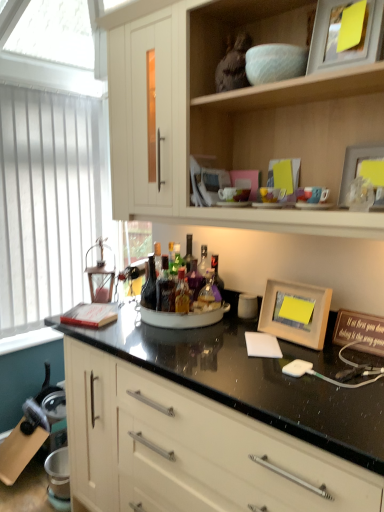
Question: Is white vertical blinds at left in front of light wood cabinet at upper center, the 1th cabinetry from the top?

Choices:
 (A) yes
 (B) no

Answer: (B)

Question: Can you confirm if white vertical blinds at left is taller than light wood cabinet at upper center, the 1th cabinetry from the top?

Choices:
 (A) no
 (B) yes

Answer: (B)

Question: Is white vertical blinds at left far from light wood cabinet at upper center, the 1th cabinetry from the top?

Choices:
 (A) yes
 (B) no

Answer: (A)

Question: Can you confirm if white vertical blinds at left is shorter than light wood cabinet at upper center, the 1th cabinetry from the top?

Choices:
 (A) no
 (B) yes

Answer: (A)

Question: Is light wood cabinet at upper center, the 1th cabinetry from the top, at the back of white vertical blinds at left?

Choices:
 (A) no
 (B) yes

Answer: (A)

Question: Considering the relative positions of white vertical blinds at left and light wood cabinet at upper center, the 1th cabinetry from the top, in the image provided, is white vertical blinds at left to the right of light wood cabinet at upper center, the 1th cabinetry from the top, from the viewer's perspective?

Choices:
 (A) yes
 (B) no

Answer: (B)

Question: Considering the relative positions of translucent glass bottle at center, the 3th bottle from the left, and white matte notepad at center in the image provided, is translucent glass bottle at center, the 3th bottle from the left, to the left of white matte notepad at center from the viewer's perspective?

Choices:
 (A) no
 (B) yes

Answer: (B)

Question: Considering the relative sizes of translucent glass bottle at center, the 1th bottle from the right, and white matte notepad at center in the image provided, is translucent glass bottle at center, the 1th bottle from the right, taller than white matte notepad at center?

Choices:
 (A) yes
 (B) no

Answer: (A)

Question: From the image's perspective, is translucent glass bottle at center, the 3th bottle from the left, over white matte notepad at center?

Choices:
 (A) yes
 (B) no

Answer: (A)

Question: Would you say translucent glass bottle at center, the 3th bottle from the left, is outside white matte notepad at center?

Choices:
 (A) yes
 (B) no

Answer: (A)

Question: Would you consider translucent glass bottle at center, the 1th bottle from the right, to be distant from white matte notepad at center?

Choices:
 (A) no
 (B) yes

Answer: (A)

Question: From a real-world perspective, is translucent glass bottle at center, the 3th bottle from the left, positioned under white matte notepad at center based on gravity?

Choices:
 (A) yes
 (B) no

Answer: (B)

Question: From the image's perspective, is translucent glass bottle at center, the 1th bottle from the right, located above white vertical blinds at left?

Choices:
 (A) yes
 (B) no

Answer: (B)